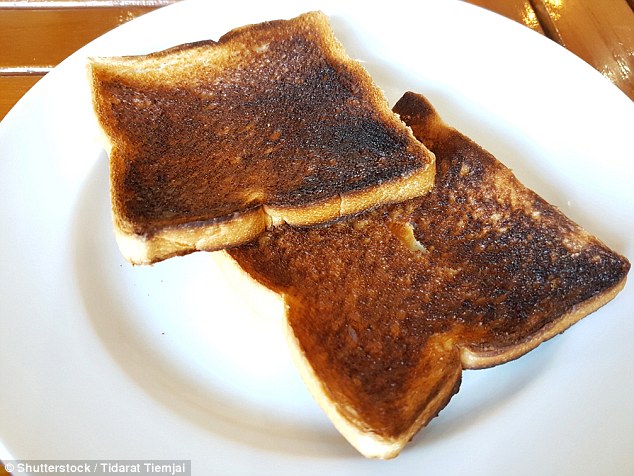
Image resolution: width=634 pixels, height=476 pixels. What are the coordinates of `shiny wood` in the screenshot? It's located at (603, 43).